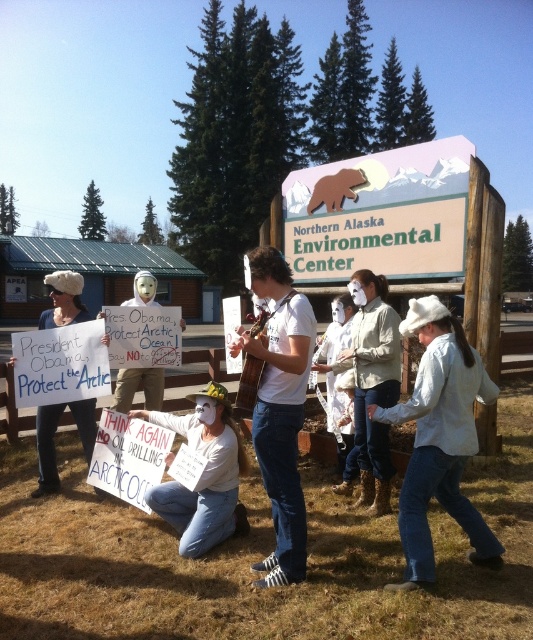
Where is `white matte mask at center`? The width and height of the screenshot is (533, 640). white matte mask at center is located at coordinates (204, 474).

Between point (216, 429) and point (60, 404), which one is positioned in front?

Positioned in front is point (216, 429).

The image size is (533, 640). I want to click on white matte mask at center, so click(204, 474).

In the scene shown: Which of these two, white denim jeans at lower right or white matte mask at center, stands taller?

Standing taller between the two is white denim jeans at lower right.

Is point (456, 369) positioned after point (189, 524)?

No, it is not.

At what (x,y) coordinates should I click in order to perform the action: click on white denim jeans at lower right. Please return your answer as a coordinate pair (x, y). This screenshot has width=533, height=640. Looking at the image, I should click on (440, 440).

The width and height of the screenshot is (533, 640). Identify the location of white denim jeans at lower right. (440, 440).

At what (x,y) coordinates should I click in order to perform the action: click on white denim jeans at lower right. Please return your answer as a coordinate pair (x, y). Looking at the image, I should click on (440, 440).

Between point (455, 493) and point (46, 456), which one is positioned behind?

The point (46, 456) is behind.

You are a GUI agent. You are given a task and a screenshot of the screen. Output one action in this format:
    pyautogui.click(x=<x>, y=<y>)
    Task: Click on the white denim jeans at lower right
    Image resolution: width=533 pixels, height=640 pixels.
    Given the screenshot: What is the action you would take?
    pyautogui.click(x=440, y=440)